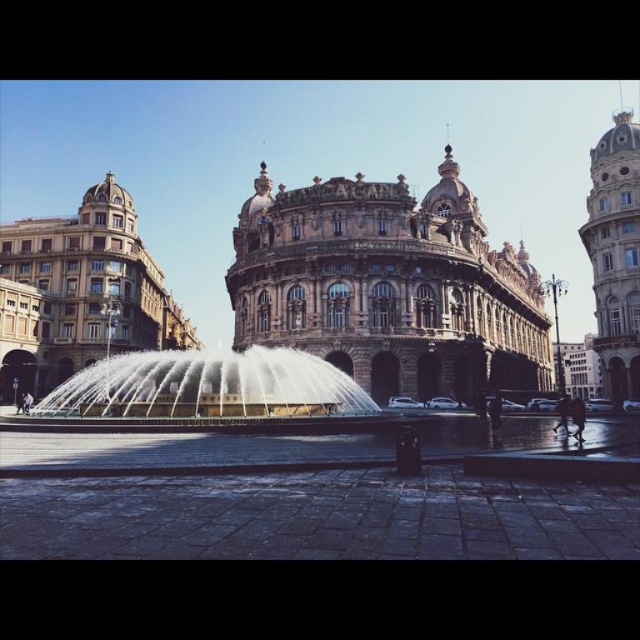
Does white marble fountain at center appear over golden stone tower at upper right?

Actually, white marble fountain at center is below golden stone tower at upper right.

Does white marble fountain at center lie in front of golden stone tower at upper right?

That is True.

The width and height of the screenshot is (640, 640). I want to click on white marble fountain at center, so pyautogui.click(x=209, y=392).

This screenshot has height=640, width=640. What are the coordinates of `white marble fountain at center` in the screenshot? It's located at (209, 392).

Which of these two, golden stone building at left or golden stone tower at upper right, stands shorter?

golden stone building at left is shorter.

Looking at this image, which is more to the right, golden stone building at left or golden stone tower at upper right?

From the viewer's perspective, golden stone tower at upper right appears more on the right side.

Is point (99, 292) farther from viewer compared to point (602, 371)?

No, it is not.

I want to click on golden stone building at left, so click(86, 289).

Does golden stone building at left have a greater width compared to white marble fountain at center?

Incorrect, golden stone building at left's width does not surpass white marble fountain at center's.

Measure the distance from golden stone building at left to white marble fountain at center.

golden stone building at left is 20.89 meters away from white marble fountain at center.

Which is behind, point (173, 339) or point (362, 404)?

Positioned behind is point (173, 339).

You are a GUI agent. You are given a task and a screenshot of the screen. Output one action in this format:
    pyautogui.click(x=<x>, y=<y>)
    Task: Click on the golden stone building at left
    
    Given the screenshot: What is the action you would take?
    [86, 289]